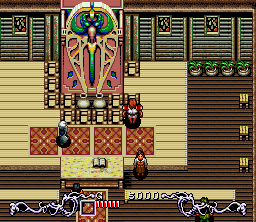
Image resolution: width=256 pixels, height=222 pixels. Find the location of `table`. table is located at coordinates (72, 171).